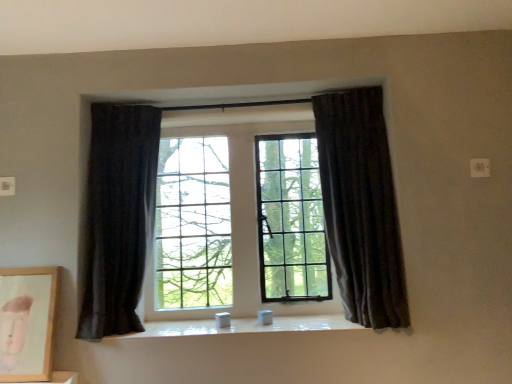
Question: Considering the relative sizes of dark fabric curtain at left, arranged as the second curtain when viewed from the right, and matte wooden picture frame at lower left in the image provided, is dark fabric curtain at left, arranged as the second curtain when viewed from the right, smaller than matte wooden picture frame at lower left?

Choices:
 (A) yes
 (B) no

Answer: (B)

Question: Can we say dark fabric curtain at left, positioned as the 1th curtain in left-to-right order, lies outside matte wooden picture frame at lower left?

Choices:
 (A) yes
 (B) no

Answer: (A)

Question: From a real-world perspective, does dark fabric curtain at left, positioned as the 1th curtain in left-to-right order, stand above matte wooden picture frame at lower left?

Choices:
 (A) no
 (B) yes

Answer: (B)

Question: From a real-world perspective, is dark fabric curtain at left, arranged as the second curtain when viewed from the right, beneath matte wooden picture frame at lower left?

Choices:
 (A) yes
 (B) no

Answer: (B)

Question: Considering the relative positions of dark fabric curtain at left, arranged as the second curtain when viewed from the right, and matte wooden picture frame at lower left in the image provided, is dark fabric curtain at left, arranged as the second curtain when viewed from the right, to the right of matte wooden picture frame at lower left from the viewer's perspective?

Choices:
 (A) no
 (B) yes

Answer: (B)

Question: Can you confirm if dark fabric curtain at left, positioned as the 1th curtain in left-to-right order, is thinner than matte wooden picture frame at lower left?

Choices:
 (A) no
 (B) yes

Answer: (A)

Question: Does dark fabric curtain at left, arranged as the second curtain when viewed from the right, have a lesser height compared to dark velvet curtain at right, arranged as the 2th curtain when viewed from the left?

Choices:
 (A) no
 (B) yes

Answer: (B)

Question: Can you confirm if dark fabric curtain at left, positioned as the 1th curtain in left-to-right order, is wider than dark velvet curtain at right, which ranks as the 1th curtain in right-to-left order?

Choices:
 (A) no
 (B) yes

Answer: (A)

Question: Can you confirm if dark fabric curtain at left, positioned as the 1th curtain in left-to-right order, is thinner than dark velvet curtain at right, arranged as the 2th curtain when viewed from the left?

Choices:
 (A) no
 (B) yes

Answer: (B)

Question: Is dark fabric curtain at left, positioned as the 1th curtain in left-to-right order, to the right of dark velvet curtain at right, which ranks as the 1th curtain in right-to-left order, from the viewer's perspective?

Choices:
 (A) no
 (B) yes

Answer: (A)

Question: From a real-world perspective, is dark fabric curtain at left, arranged as the second curtain when viewed from the right, positioned under dark velvet curtain at right, arranged as the 2th curtain when viewed from the left, based on gravity?

Choices:
 (A) no
 (B) yes

Answer: (B)

Question: Is dark fabric curtain at left, positioned as the 1th curtain in left-to-right order, smaller than dark velvet curtain at right, arranged as the 2th curtain when viewed from the left?

Choices:
 (A) no
 (B) yes

Answer: (B)

Question: Is the surface of dark velvet curtain at right, arranged as the 2th curtain when viewed from the left, in direct contact with matte wooden picture frame at lower left?

Choices:
 (A) no
 (B) yes

Answer: (A)